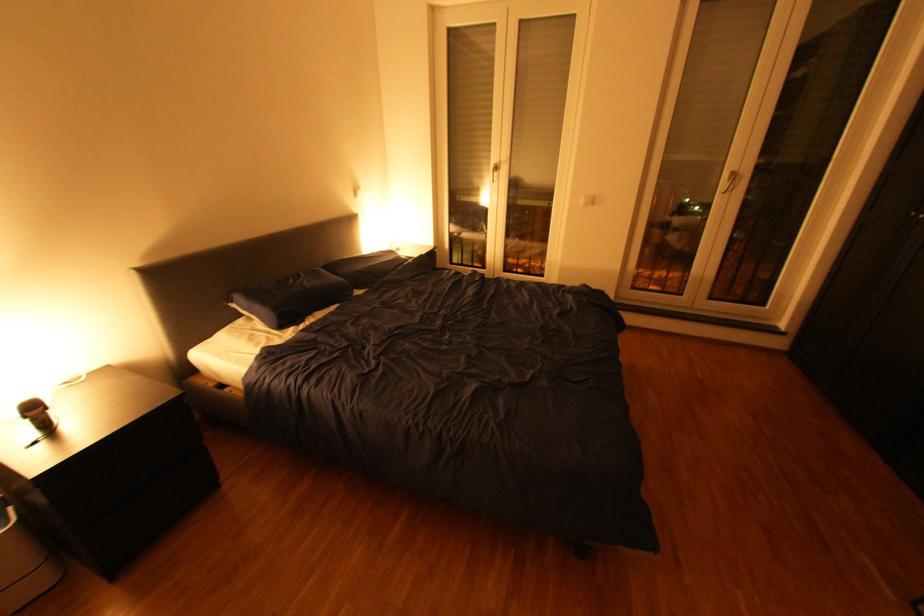
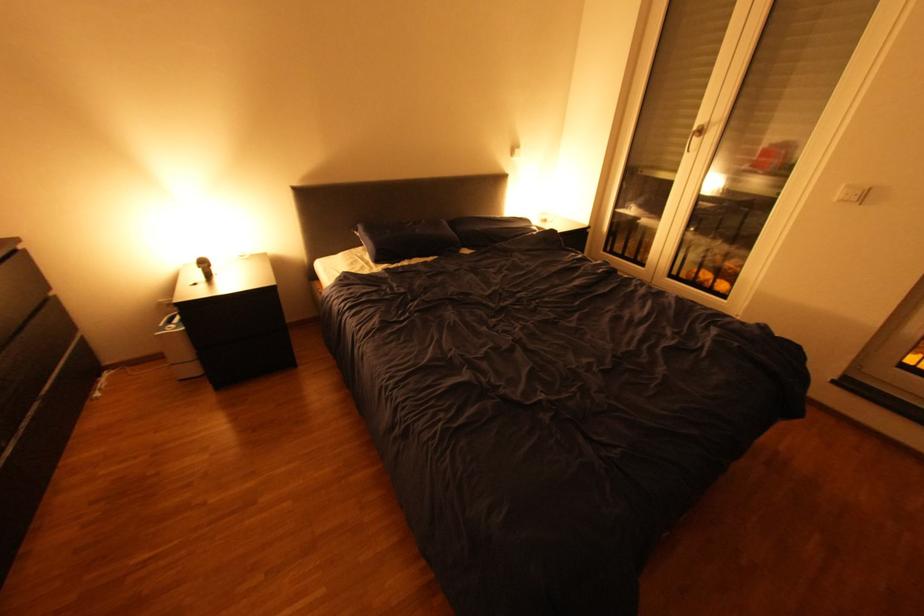
Question: The camera is either moving clockwise (left) or counter-clockwise (right) around the object. The first image is from the beginning of the video and the second image is from the end. Is the camera moving left or right when shooting the video?

Choices:
 (A) Left
 (B) Right

Answer: (B)